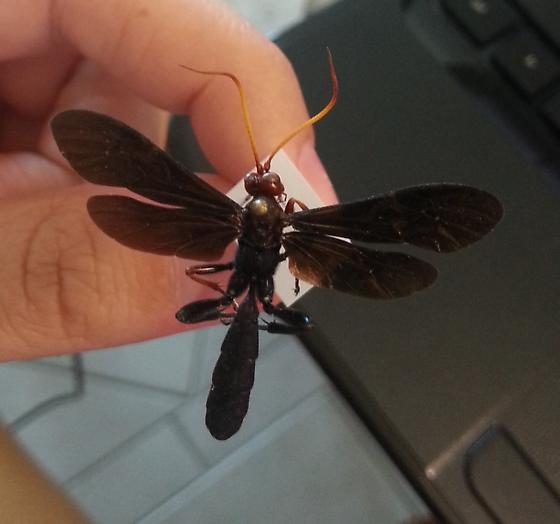
The image size is (560, 524). Identify the location of tabletop. (135, 466).